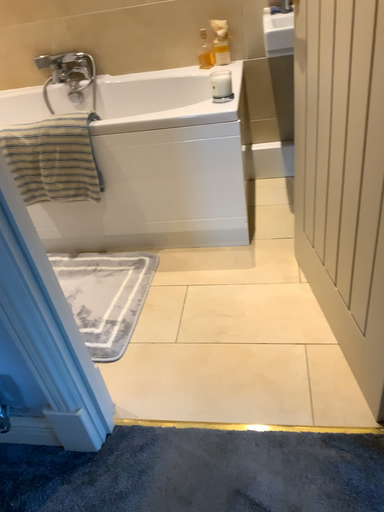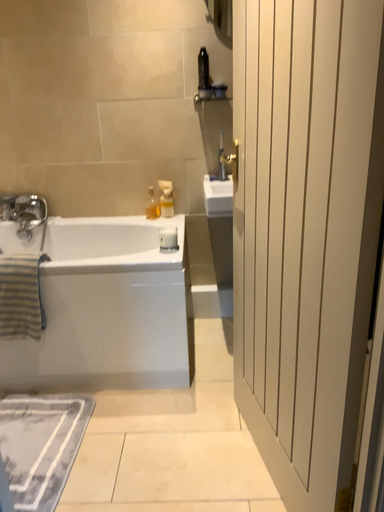
Question: Which way did the camera rotate in the video?

Choices:
 (A) rotated upward
 (B) rotated downward

Answer: (A)